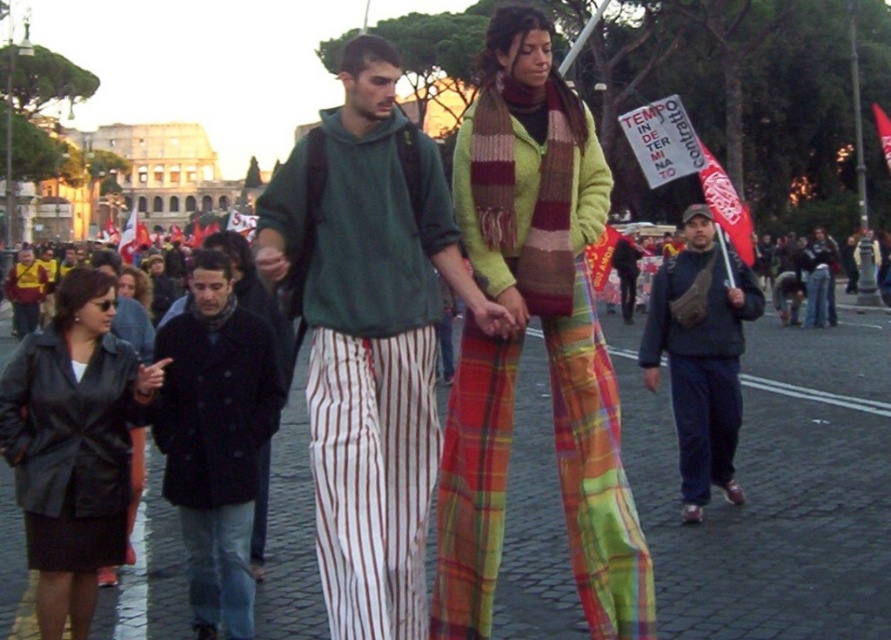
Is knitted wool scarf at center shorter than dark blue wool coat at center?

In fact, knitted wool scarf at center may be taller than dark blue wool coat at center.

Is the position of knitted wool scarf at center more distant than that of dark blue wool coat at center?

No.

Where is `knitted wool scarf at center`? Image resolution: width=891 pixels, height=640 pixels. knitted wool scarf at center is located at coordinates (544, 342).

You are a GUI agent. You are given a task and a screenshot of the screen. Output one action in this format:
    pyautogui.click(x=<x>, y=<y>)
    Task: Click on the knitted wool scarf at center
    
    Given the screenshot: What is the action you would take?
    pyautogui.click(x=544, y=342)

Looking at this image, does black leather jacket at lower left appear under dark blue jeans at center?

Correct, black leather jacket at lower left is located below dark blue jeans at center.

Which is in front, point (56, 515) or point (816, 288)?

Point (56, 515)

Does point (124, 476) lie behind point (820, 264)?

No, (124, 476) is in front of (820, 264).

This screenshot has width=891, height=640. Identify the location of black leather jacket at lower left. (72, 445).

Between dark blue fleece at center and leather jacket at center, which one is positioned higher?

Positioned higher is leather jacket at center.

I want to click on dark blue fleece at center, so click(x=700, y=355).

Who is more distant from viewer, (674, 257) or (168, 280)?

Point (168, 280)

Find the location of a particular element. This screenshot has height=640, width=891. dark blue fleece at center is located at coordinates (700, 355).